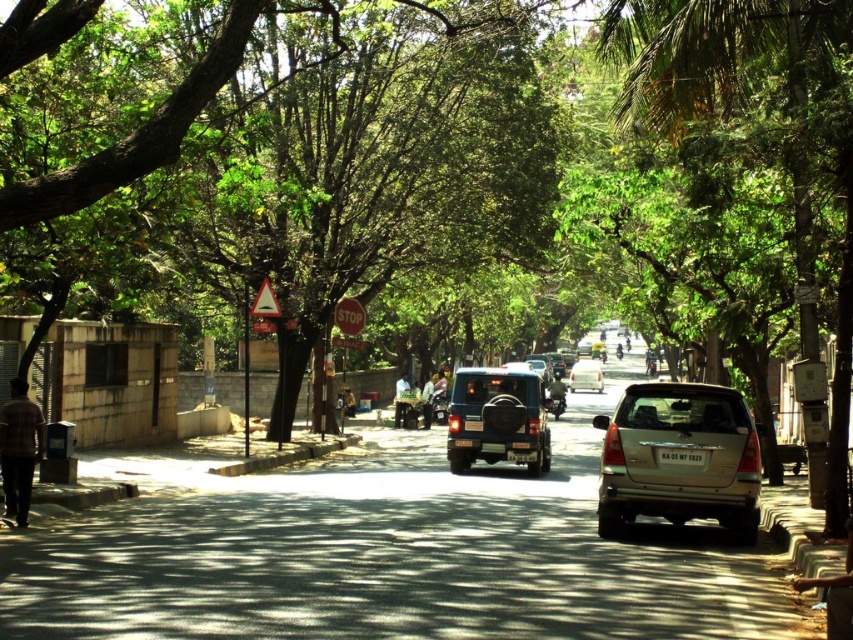
How distant is matte black suv at center from silver metallic suv at center?

39.51 meters

Is matte black suv at center further to camera compared to silver metallic suv at center?

No, matte black suv at center is in front of silver metallic suv at center.

Describe the element at coordinates (497, 419) in the screenshot. I see `matte black suv at center` at that location.

Image resolution: width=853 pixels, height=640 pixels. What are the coordinates of `matte black suv at center` in the screenshot? It's located at (497, 419).

Which is below, gold metallic suv at center or silver metallic suv at center?

silver metallic suv at center is lower down.

Can you confirm if gold metallic suv at center is smaller than silver metallic suv at center?

Correct, gold metallic suv at center occupies less space than silver metallic suv at center.

The image size is (853, 640). I want to click on gold metallic suv at center, so [679, 458].

This screenshot has width=853, height=640. In order to click on gold metallic suv at center in this screenshot , I will do [679, 458].

Is green leafy tree at center above silver metallic suv at center?

Yes.

Is green leafy tree at center in front of silver metallic suv at center?

Yes.

Find the location of a particular element. This screenshot has width=853, height=640. green leafy tree at center is located at coordinates (357, 154).